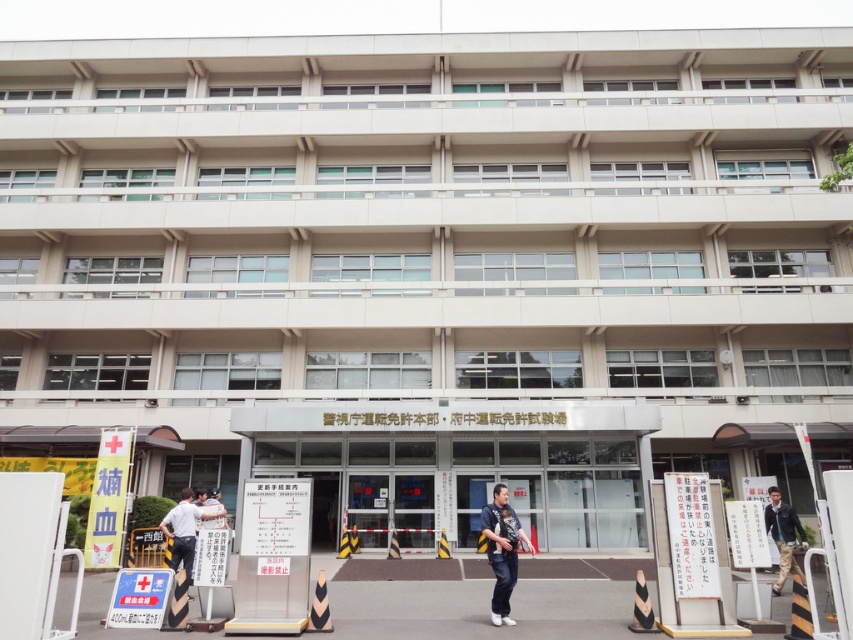
Consider the image. You are standing in front of the building and see the dark blue jeans at center and the dark blue jacket at center. Which item is positioned higher up?

The dark blue jeans at center is above the dark blue jacket at center, so the dark blue jeans at center is positioned higher up.

Where is the dark blue jeans at center located in the image?

The dark blue jeans at center is located at the 2D coordinates point of (x=502, y=550) in the image.